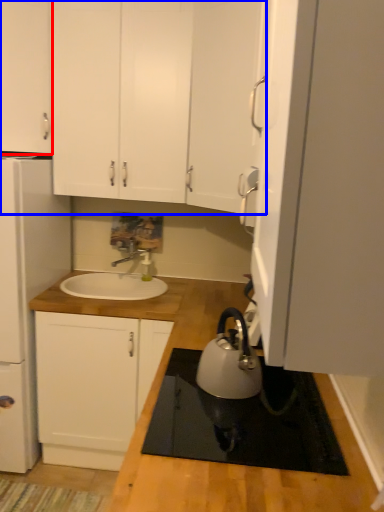
Question: Which object appears farthest to the camera in this image, cabinetry (highlighted by a red box) or cabinetry (highlighted by a blue box)?

Choices:
 (A) cabinetry
 (B) cabinetry

Answer: (B)